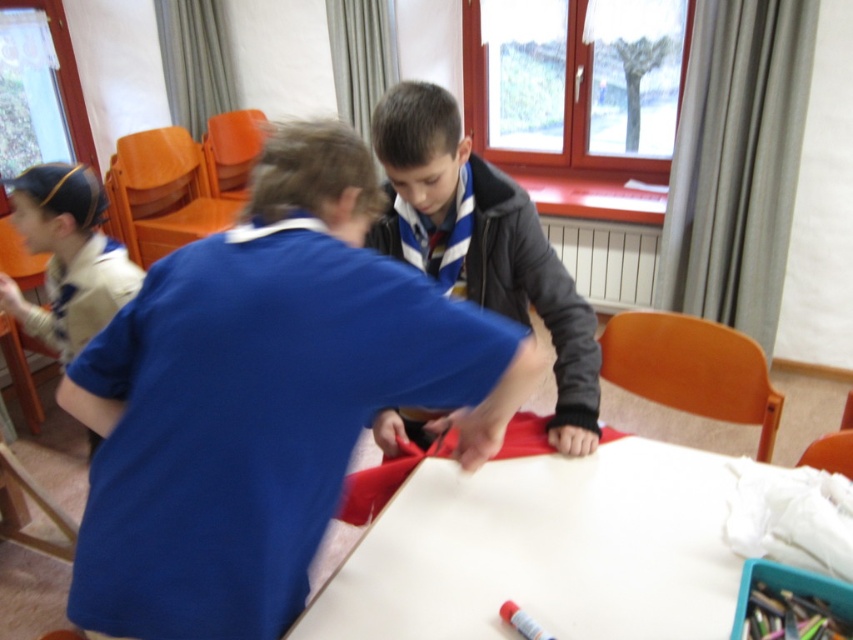
Question: Considering the real-world distances, which object is closest to the dark gray woolen sweater at center?

Choices:
 (A) blue fabric at center
 (B) white matte table at center

Answer: (B)

Question: Is blue fabric at center closer to camera compared to white matte table at center?

Choices:
 (A) yes
 (B) no

Answer: (A)

Question: Which is farther from the dark gray woolen sweater at center?

Choices:
 (A) white matte table at center
 (B) blue fabric at center

Answer: (B)

Question: Does dark gray woolen sweater at center have a lesser width compared to matte plastic crayon at lower center?

Choices:
 (A) yes
 (B) no

Answer: (B)

Question: Does blue fabric at center have a larger size compared to dark gray woolen sweater at center?

Choices:
 (A) yes
 (B) no

Answer: (A)

Question: Which is farther from the dark gray woolen sweater at center?

Choices:
 (A) matte plastic crayon at lower center
 (B) white matte table at center
 (C) blue fabric at center

Answer: (A)